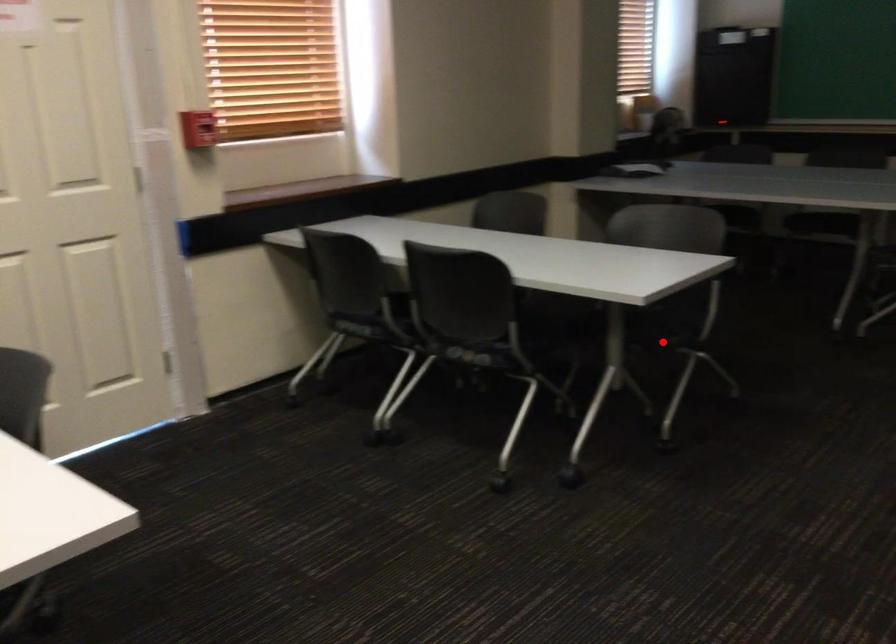
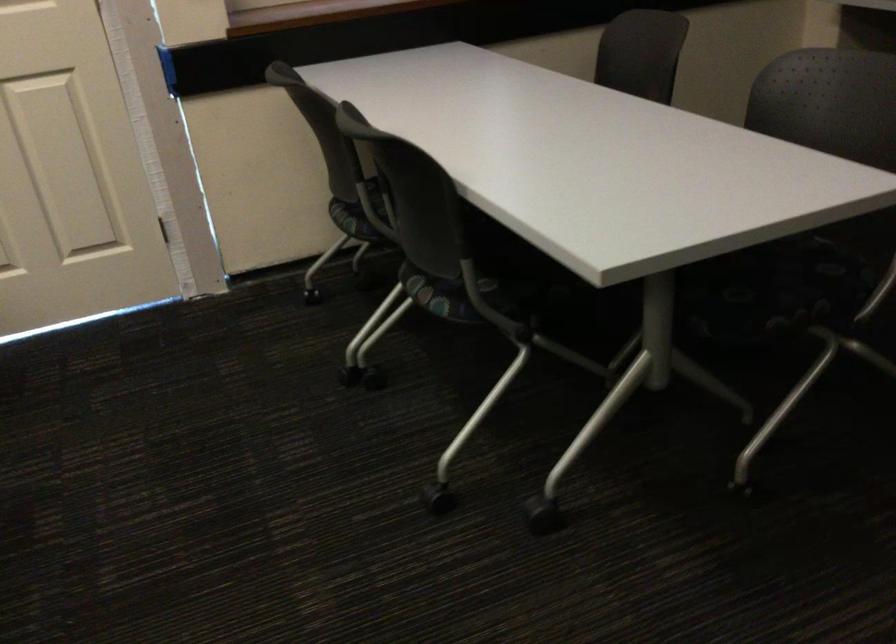
Where in the second image is the point corresponding to the highlighted location from the first image?

(748, 326)